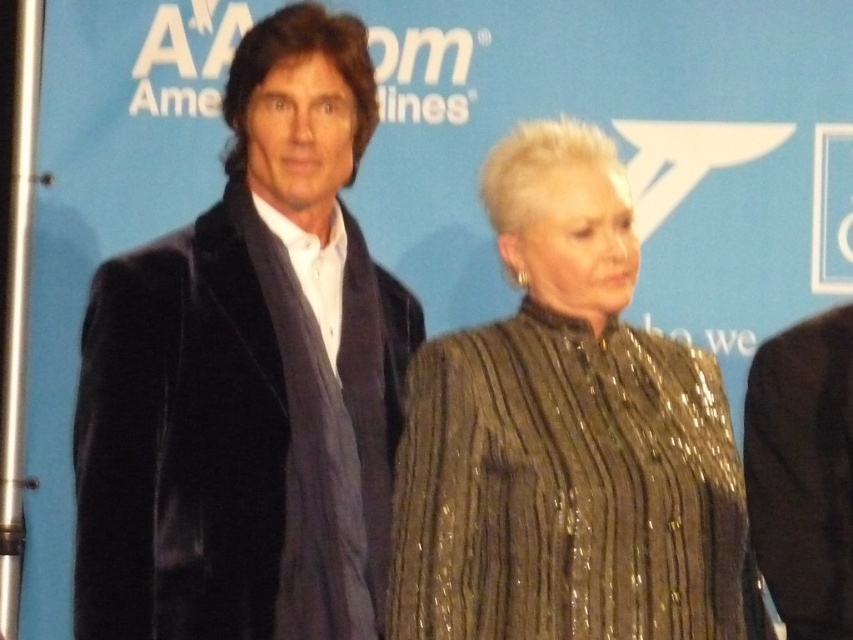
Based on the scene description, which object is taller between the shiny sequined dress at center and the black velvet suit at right?

The shiny sequined dress at center is taller than the black velvet suit at right according to the description.

You are a photographer setting up for a group photo. You have two key elements to consider in the foreground and middle sections of the image. The velvet black coat at left and the shiny sequined dress at center are both important. Based on their sizes, which one might require more lighting adjustments to ensure visibility in the final shot?

The velvet black coat at left has a larger size compared to the shiny sequined dress at center. Since it is larger, it might require more lighting adjustments to ensure its details are visible, especially in contrast to the shiny sequined dress which could reflect more light.